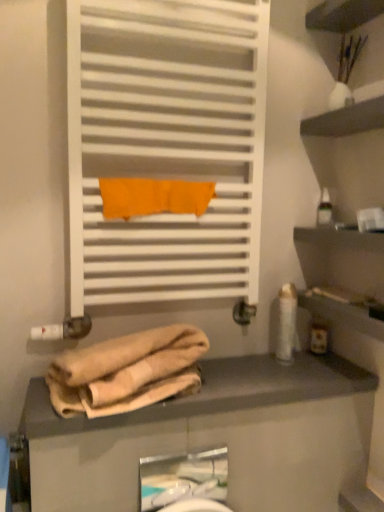
Question: Is white glossy lotion at right, which is the second toiletry in top-to-bottom order, oriented away from beige fabric at lower center?

Choices:
 (A) yes
 (B) no

Answer: (B)

Question: Does white glossy lotion at right, marked as the third toiletry in a right-to-left arrangement, have a smaller size compared to beige fabric at lower center?

Choices:
 (A) yes
 (B) no

Answer: (A)

Question: Is white glossy lotion at right, the 2th toiletry positioned from the bottom, to the right of beige fabric at lower center from the viewer's perspective?

Choices:
 (A) yes
 (B) no

Answer: (A)

Question: From a real-world perspective, is white glossy lotion at right, marked as the third toiletry in a right-to-left arrangement, located beneath beige fabric at lower center?

Choices:
 (A) yes
 (B) no

Answer: (B)

Question: Can you confirm if white glossy lotion at right, the 1th toiletry in the left-to-right sequence, is taller than beige fabric at lower center?

Choices:
 (A) yes
 (B) no

Answer: (A)

Question: From the image's perspective, is transparent plastic bottle at upper right, the first toiletry positioned from the right, positioned above or below orange fabric towel at center?

Choices:
 (A) above
 (B) below

Answer: (A)

Question: Looking at their shapes, would you say transparent plastic bottle at upper right, the 3th toiletry in the bottom-to-top sequence, is wider or thinner than orange fabric towel at center?

Choices:
 (A) wide
 (B) thin

Answer: (B)

Question: Is transparent plastic bottle at upper right, the third toiletry viewed from the left, spatially inside orange fabric towel at center, or outside of it?

Choices:
 (A) outside
 (B) inside

Answer: (A)

Question: From a real-world perspective, relative to orange fabric towel at center, is transparent plastic bottle at upper right, which is counted as the 1th toiletry, starting from the top, vertically above or below?

Choices:
 (A) below
 (B) above

Answer: (A)

Question: From the image's perspective, is white matte towel rack at upper center positioned above or below beige fabric at lower center?

Choices:
 (A) above
 (B) below

Answer: (A)

Question: Considering the relative positions of white matte towel rack at upper center and beige fabric at lower center in the image provided, is white matte towel rack at upper center to the left or to the right of beige fabric at lower center?

Choices:
 (A) left
 (B) right

Answer: (A)

Question: Considering their positions, is white matte towel rack at upper center located in front of or behind beige fabric at lower center?

Choices:
 (A) behind
 (B) front

Answer: (A)

Question: Considering the positions of white matte towel rack at upper center and beige fabric at lower center in the image, is white matte towel rack at upper center taller or shorter than beige fabric at lower center?

Choices:
 (A) short
 (B) tall

Answer: (B)

Question: Looking at their shapes, would you say white glossy lotion at right, marked as the third toiletry in a right-to-left arrangement, is wider or thinner than white matte towel rack at upper center?

Choices:
 (A) wide
 (B) thin

Answer: (B)

Question: Considering the positions of point [x=284, y=293] and point [x=236, y=201], is point [x=284, y=293] closer or farther from the camera than point [x=236, y=201]?

Choices:
 (A) closer
 (B) farther

Answer: (B)